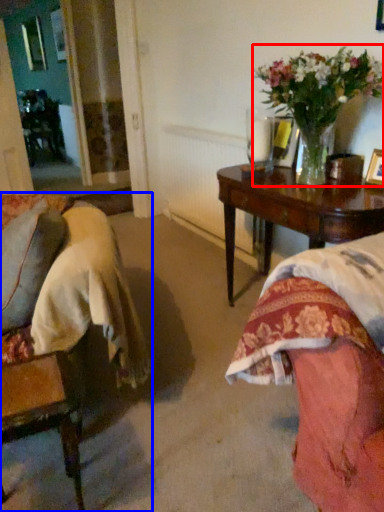
Question: Among these objects, which one is nearest to the camera, houseplant (highlighted by a red box) or chair (highlighted by a blue box)?

Choices:
 (A) houseplant
 (B) chair

Answer: (B)